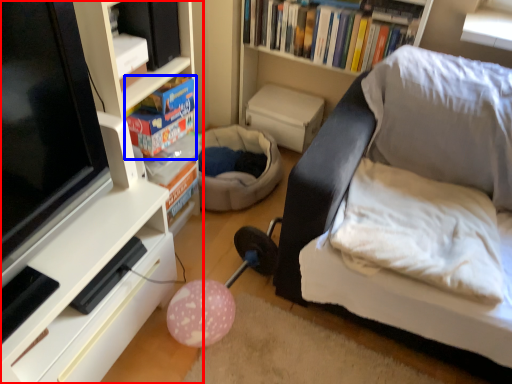
Question: Which point is closer to the camera, shelf (highlighted by a red box) or book (highlighted by a blue box)?

Choices:
 (A) shelf
 (B) book

Answer: (A)